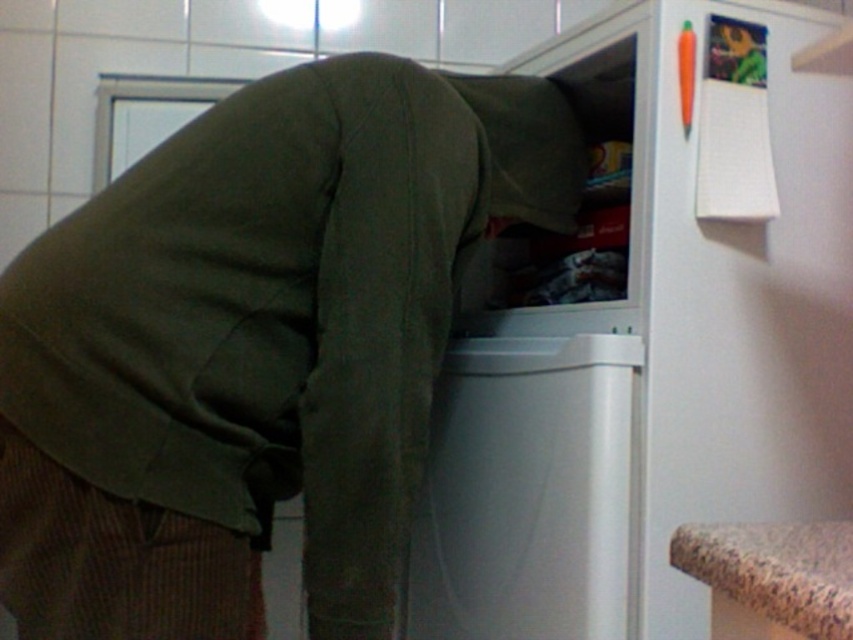
You are trying to hang a picture on the wall behind the refrigerator. You have two nails at the coordinates point (1, 561) and point (633, 483). Which nail is closer to you so you can reach it easily?

Point (1, 561) is closer to the viewer than point (633, 483), so you can reach it easily.

You are trying to reach the top shelf of the refrigerator while standing in front of the dark green hoodie at center and the white plastic dishwasher at center. Which object is closer to the top of the refrigerator?

The dark green hoodie at center is much taller than the white plastic dishwasher at center, so the dark green hoodie at center is closer to the top of the refrigerator.

You are trying to reach the top shelf of the white matte refrigerator at center while standing behind the dark green hoodie at center. Can you easily access the top shelf?

The dark green hoodie at center is in front of the white matte refrigerator at center, so you cannot easily access the top shelf because the hoodie is blocking your path.